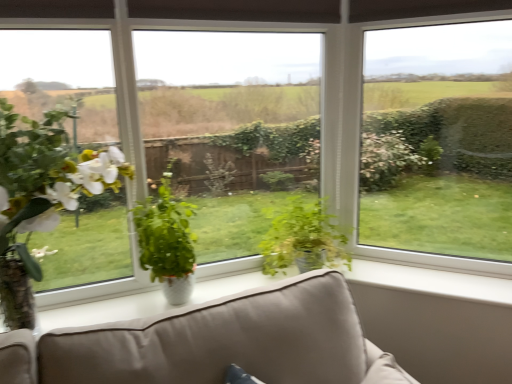
Question: Does green glossy plant at center, the 3th houseplant when ordered from left to right, lie in front of transparent glass window at center?

Choices:
 (A) yes
 (B) no

Answer: (B)

Question: Is green glossy plant at center, which ranks as the first houseplant in right-to-left order, positioned beyond the bounds of transparent glass window at center?

Choices:
 (A) yes
 (B) no

Answer: (A)

Question: Is green glossy plant at center, the 3th houseplant when ordered from left to right, further to the viewer compared to transparent glass window at center?

Choices:
 (A) no
 (B) yes

Answer: (B)

Question: Can you confirm if green glossy plant at center, the 3th houseplant when ordered from left to right, is bigger than transparent glass window at center?

Choices:
 (A) no
 (B) yes

Answer: (B)

Question: Can transparent glass window at center be found inside green glossy plant at center, the 3th houseplant when ordered from left to right?

Choices:
 (A) yes
 (B) no

Answer: (B)

Question: Can you confirm if green glossy plant at center, the 3th houseplant when ordered from left to right, is shorter than transparent glass window at center?

Choices:
 (A) no
 (B) yes

Answer: (B)

Question: Would you say green glossy plant at center, which is counted as the 2th houseplant, starting from the right, is a long distance from green glossy plant at center, the 3th houseplant when ordered from left to right?

Choices:
 (A) yes
 (B) no

Answer: (B)

Question: Is green glossy plant at center, the 2th houseplant viewed from the left, with green glossy plant at center, the 3th houseplant when ordered from left to right?

Choices:
 (A) yes
 (B) no

Answer: (B)

Question: Can you confirm if green glossy plant at center, the 2th houseplant viewed from the left, is wider than green glossy plant at center, which ranks as the first houseplant in right-to-left order?

Choices:
 (A) no
 (B) yes

Answer: (A)

Question: Is green glossy plant at center, the 2th houseplant viewed from the left, turned away from green glossy plant at center, which ranks as the first houseplant in right-to-left order?

Choices:
 (A) yes
 (B) no

Answer: (B)

Question: Could green glossy plant at center, which ranks as the first houseplant in right-to-left order, be considered to be inside green glossy plant at center, the 2th houseplant viewed from the left?

Choices:
 (A) yes
 (B) no

Answer: (B)

Question: Considering the relative sizes of green glossy plant at center, which is counted as the 2th houseplant, starting from the right, and green glossy plant at center, the 3th houseplant when ordered from left to right, in the image provided, is green glossy plant at center, which is counted as the 2th houseplant, starting from the right, bigger than green glossy plant at center, the 3th houseplant when ordered from left to right,?

Choices:
 (A) no
 (B) yes

Answer: (A)

Question: From a real-world perspective, does green glossy plant at center, which is counted as the 2th houseplant, starting from the right, stand above transparent glass window at center?

Choices:
 (A) no
 (B) yes

Answer: (A)